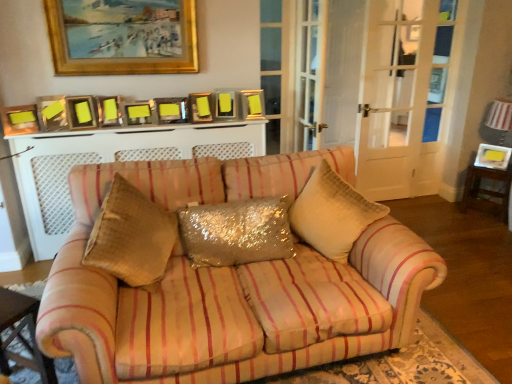
Question: Considering the relative sizes of striped fabric couch at center and glittery sequined pillow at center in the image provided, is striped fabric couch at center thinner than glittery sequined pillow at center?

Choices:
 (A) yes
 (B) no

Answer: (B)

Question: Is striped fabric couch at center positioned behind glittery sequined pillow at center?

Choices:
 (A) no
 (B) yes

Answer: (A)

Question: Is striped fabric couch at center facing towards glittery sequined pillow at center?

Choices:
 (A) no
 (B) yes

Answer: (A)

Question: From the image's perspective, is striped fabric couch at center below glittery sequined pillow at center?

Choices:
 (A) yes
 (B) no

Answer: (A)

Question: Is striped fabric couch at center looking in the opposite direction of glittery sequined pillow at center?

Choices:
 (A) no
 (B) yes

Answer: (A)

Question: Looking at their shapes, would you say shiny gold pillow at center is wider or thinner than metallic gold picture frame at right, which is the 1th picture frame from bottom to top?

Choices:
 (A) thin
 (B) wide

Answer: (B)

Question: Is shiny gold pillow at center spatially inside metallic gold picture frame at right, which appears as the 10th picture frame when viewed from the left, or outside of it?

Choices:
 (A) inside
 (B) outside

Answer: (B)

Question: Is shiny gold pillow at center bigger or smaller than metallic gold picture frame at right, the 10th picture frame positioned from the front?

Choices:
 (A) small
 (B) big

Answer: (B)

Question: Is shiny gold pillow at center taller or shorter than metallic gold picture frame at right, which appears as the 10th picture frame when viewed from the left?

Choices:
 (A) short
 (B) tall

Answer: (B)

Question: Is matte gold picture frame at upper center, which is counted as the ninth picture frame, starting from the bottom, inside the boundaries of wooden table at lower left, the 1th table when ordered from front to back, or outside?

Choices:
 (A) outside
 (B) inside

Answer: (A)

Question: In the image, is matte gold picture frame at upper center, the 9th picture frame in the left-to-right sequence, positioned in front of or behind wooden table at lower left, which appears as the second table when viewed from the top?

Choices:
 (A) front
 (B) behind

Answer: (B)

Question: From their relative heights in the image, would you say matte gold picture frame at upper center, which is the third picture frame in back-to-front order, is taller or shorter than wooden table at lower left, which appears as the first table when viewed from the left?

Choices:
 (A) short
 (B) tall

Answer: (A)

Question: Looking at the image, does matte gold picture frame at upper center, the 9th picture frame in the left-to-right sequence, seem bigger or smaller compared to wooden table at lower left, the 2th table when ordered from right to left?

Choices:
 (A) small
 (B) big

Answer: (A)

Question: From a real-world perspective, is striped fabric couch at center above or below glittery sequined pillow at center?

Choices:
 (A) below
 (B) above

Answer: (A)

Question: Is striped fabric couch at center in front of or behind glittery sequined pillow at center in the image?

Choices:
 (A) front
 (B) behind

Answer: (A)